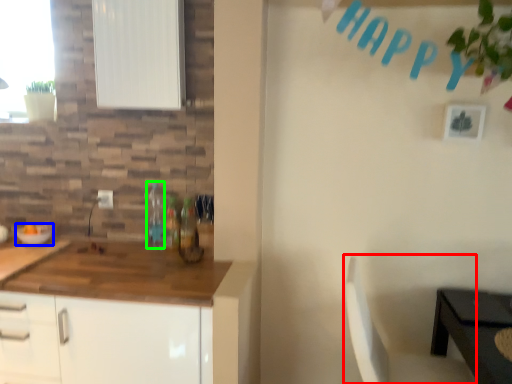
Question: Based on their relative distances, which object is farther from chair (highlighted by a red box)? Choose from bowl (highlighted by a blue box) and bottle (highlighted by a green box).

Choices:
 (A) bowl
 (B) bottle

Answer: (A)